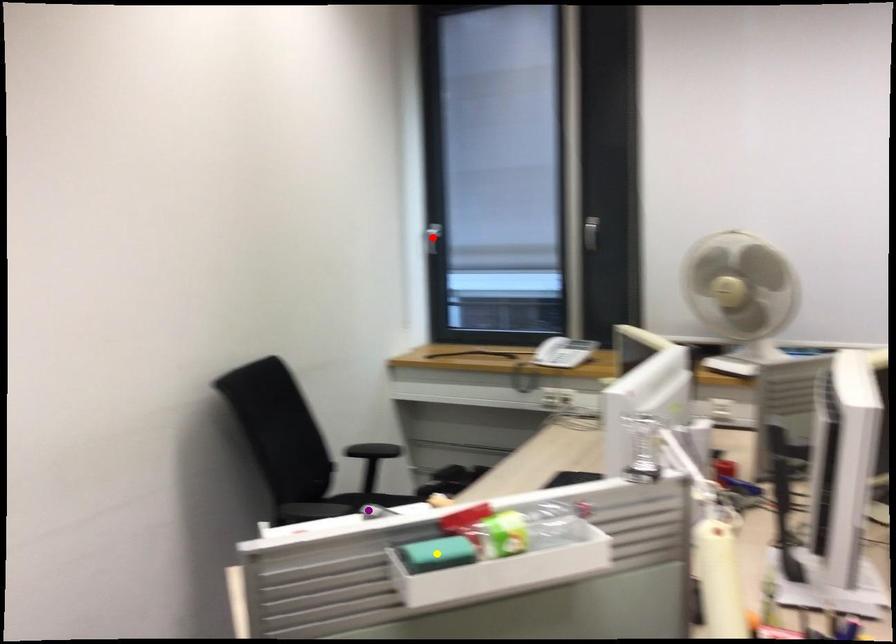
Order these from nearest to farthest:
A) red point
B) purple point
C) yellow point

yellow point < purple point < red point